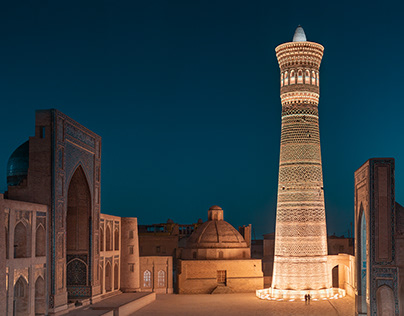
The image size is (404, 316). In order to click on doorway on the right side in this screenshot , I will do `click(338, 277)`.